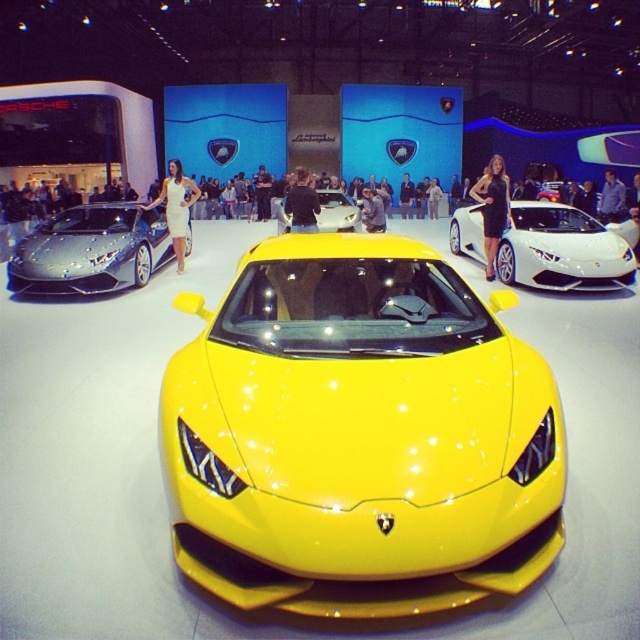
Question: In this image, where is black glossy dress at center located relative to white dress at left?

Choices:
 (A) left
 (B) right

Answer: (B)

Question: Can you confirm if shiny yellow sports car at center is positioned above black glossy dress at center?

Choices:
 (A) yes
 (B) no

Answer: (B)

Question: Is shiny metallic car at left above white dress at left?

Choices:
 (A) no
 (B) yes

Answer: (A)

Question: Which of the following is the farthest from the observer?

Choices:
 (A) (92, 236)
 (B) (508, 186)
 (C) (177, 177)
 (D) (564, 211)

Answer: (D)

Question: Which point appears closest to the camera in this image?

Choices:
 (A) (176, 172)
 (B) (588, 240)
 (C) (61, 227)
 (D) (492, 218)

Answer: (B)

Question: Which object is the farthest from the glossy white car at center?

Choices:
 (A) shiny metallic car at left
 (B) white dress at left
 (C) shiny yellow sports car at center
 (D) black glossy dress at center

Answer: (C)